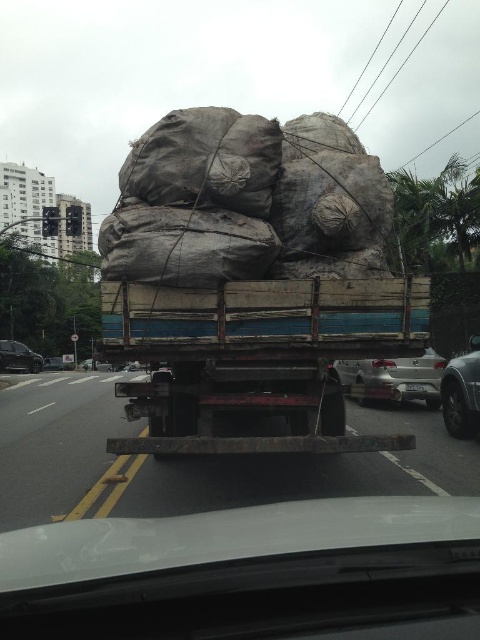
Can you confirm if white matte car at center is taller than metallic silver car at right?

In fact, white matte car at center may be shorter than metallic silver car at right.

Which is in front, point (9, 627) or point (450, 404)?

Positioned in front is point (9, 627).

Where is `white matte car at center`? This screenshot has height=640, width=480. white matte car at center is located at coordinates click(248, 572).

Is wooden trailer truck at center to the left of metallic silver car at right from the viewer's perspective?

Yes, wooden trailer truck at center is to the left of metallic silver car at right.

Does wooden trailer truck at center have a larger size compared to metallic silver car at right?

Correct, wooden trailer truck at center is larger in size than metallic silver car at right.

The width and height of the screenshot is (480, 640). I want to click on wooden trailer truck at center, so 257,356.

Can you confirm if white matte car at center is thinner than wooden trailer truck at center?

Indeed, white matte car at center has a lesser width compared to wooden trailer truck at center.

Between white matte car at center and wooden trailer truck at center, which one has more height?

wooden trailer truck at center is taller.

This screenshot has width=480, height=640. In order to click on white matte car at center in this screenshot , I will do `click(248, 572)`.